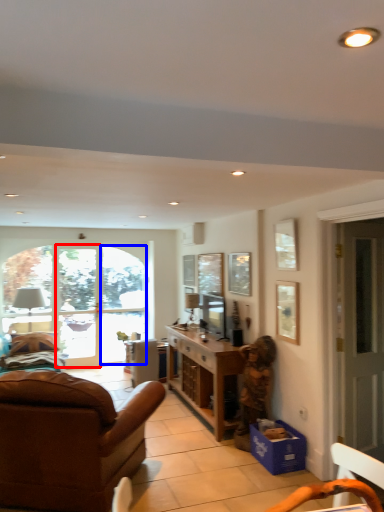
Question: Among these objects, which one is nearest to the camera, glass door (highlighted by a red box) or window (highlighted by a blue box)?

Choices:
 (A) glass door
 (B) window

Answer: (A)